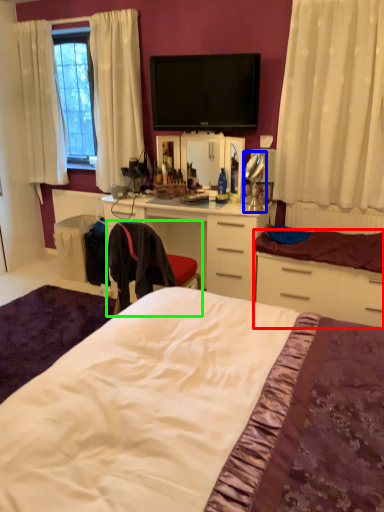
Question: Based on their relative distances, which object is farther from cabinetry (highlighted by a red box)? Choose from table lamp (highlighted by a blue box) and chair (highlighted by a green box).

Choices:
 (A) table lamp
 (B) chair

Answer: (B)